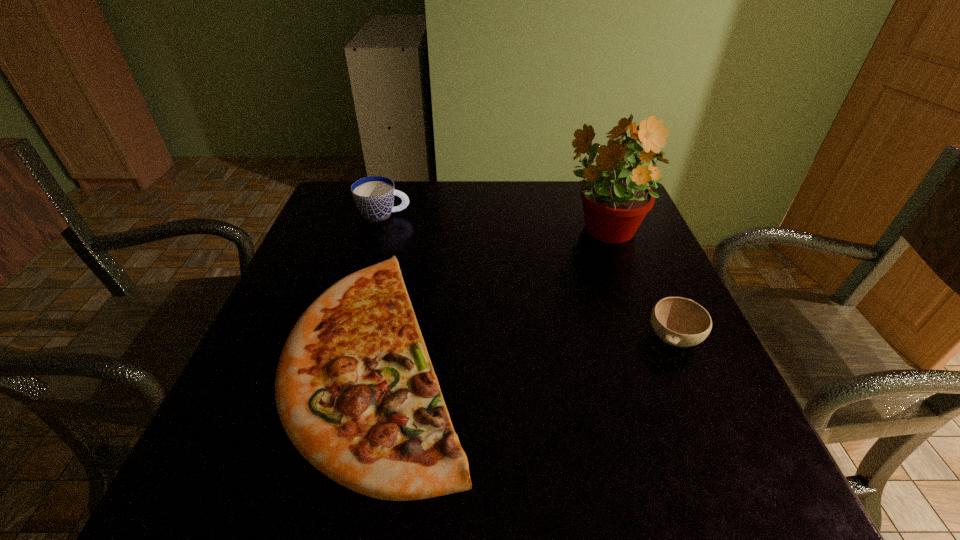
Identify the location of vacant space that satisfies the following two spatial constraints: 1. on the side of the third shortest object with the handle; 2. on the left side of the pizza. The image size is (960, 540). (342, 355).

Where is `vacant point that satisfies the following two spatial constraints: 1. on the side of the third shortest object with the handle; 2. on the right side of the pizza`? This screenshot has width=960, height=540. vacant point that satisfies the following two spatial constraints: 1. on the side of the third shortest object with the handle; 2. on the right side of the pizza is located at coordinates (342, 355).